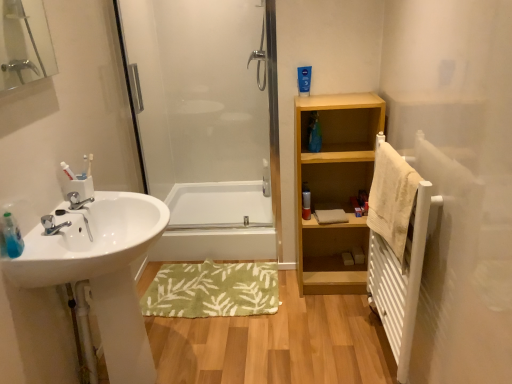
Question: Should I look upward or downward to see beige textured towel at right?

Choices:
 (A) up
 (B) down

Answer: (B)

Question: From the image's perspective, is green soft bath mat at center over beige textured towel at right?

Choices:
 (A) yes
 (B) no

Answer: (B)

Question: Does green soft bath mat at center have a smaller size compared to beige textured towel at right?

Choices:
 (A) yes
 (B) no

Answer: (B)

Question: Is beige textured towel at right inside green soft bath mat at center?

Choices:
 (A) yes
 (B) no

Answer: (B)

Question: Is the depth of green soft bath mat at center less than that of beige textured towel at right?

Choices:
 (A) no
 (B) yes

Answer: (A)

Question: Is there a large distance between green soft bath mat at center and beige textured towel at right?

Choices:
 (A) yes
 (B) no

Answer: (A)

Question: Can you confirm if green soft bath mat at center is shorter than beige textured towel at right?

Choices:
 (A) no
 (B) yes

Answer: (B)

Question: From the image's perspective, is white glossy sink at left under silver metallic faucet at sink left?

Choices:
 (A) yes
 (B) no

Answer: (A)

Question: Does white glossy sink at left turn towards silver metallic faucet at sink left?

Choices:
 (A) no
 (B) yes

Answer: (A)

Question: From a real-world perspective, does white glossy sink at left sit lower than silver metallic faucet at sink left?

Choices:
 (A) yes
 (B) no

Answer: (A)

Question: Is white glossy sink at left oriented away from silver metallic faucet at sink left?

Choices:
 (A) yes
 (B) no

Answer: (B)

Question: From the image's perspective, is white glossy sink at left located above silver metallic faucet at sink left?

Choices:
 (A) yes
 (B) no

Answer: (B)

Question: From a real-world perspective, is white glossy sink at left on top of silver metallic faucet at sink left?

Choices:
 (A) no
 (B) yes

Answer: (A)

Question: From a real-world perspective, is matte silver canister at center located beneath white glossy bathtub at center?

Choices:
 (A) yes
 (B) no

Answer: (B)